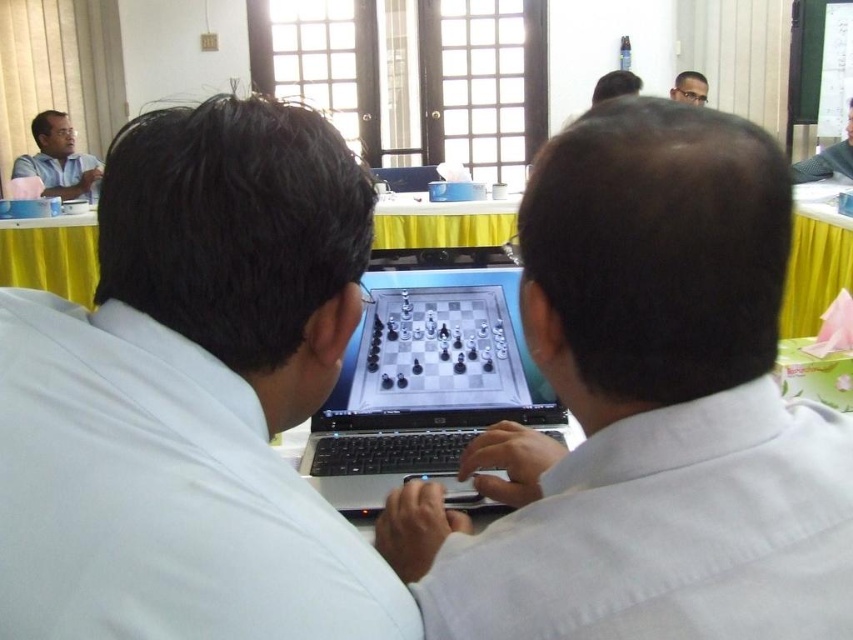
You are organizing a photo shoot and need to ensure that the white matte shirt at center and the matte black hair at upper center are both visible in the frame. Based on their sizes, which object should you prioritize positioning closer to the camera to ensure visibility?

The white matte shirt at center should be positioned closer to the camera since it occupies less space than the matte black hair at upper center, making it smaller and potentially harder to see from a distance.

You are standing in the room and want to place a small vase on the yellow fabric table at center. The table is at point (50, 256). Can you confirm the exact coordinates of the yellow fabric table at center?

The yellow fabric table at center is located at point (50, 256).

You are a photographer in a room with a table where two people are playing chess. You need to take a photo of the white matte shirt at center and the matte black hair at upper center. Which object should you focus on first to ensure both are in focus?

The white matte shirt at center is closer to the viewer than the matte black hair at upper center, so you should focus on the white matte shirt at center first to ensure both are in focus.